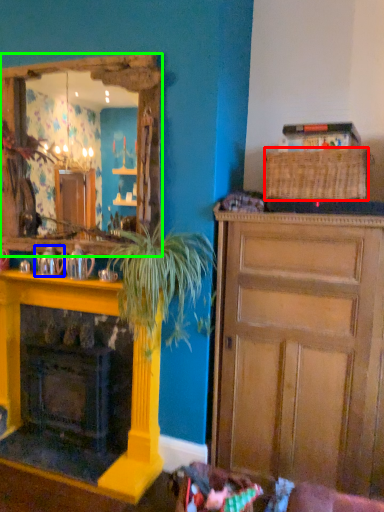
Question: Which is farther away from picnic basket (highlighted by a red box)? teapot (highlighted by a blue box) or cabinetry (highlighted by a green box)?

Choices:
 (A) teapot
 (B) cabinetry

Answer: (A)